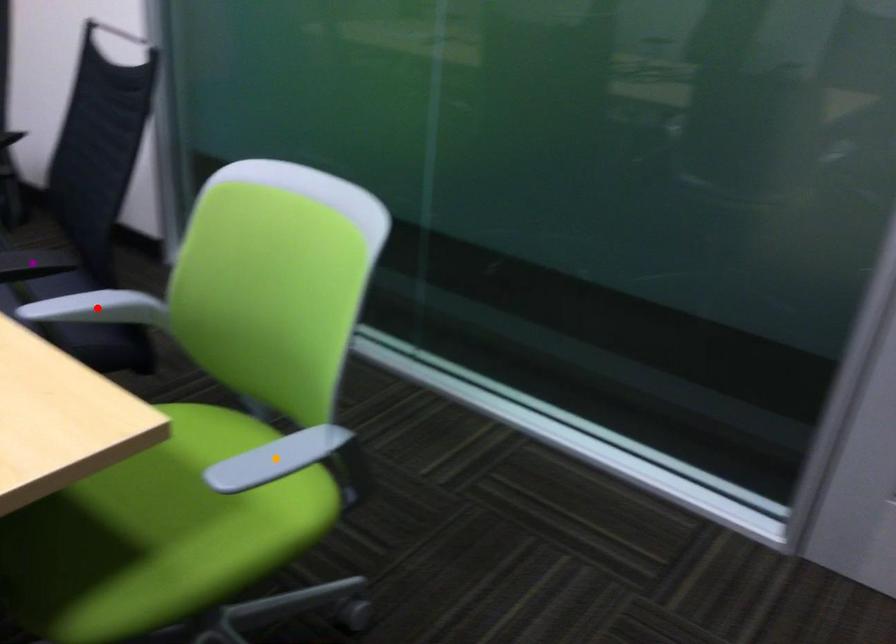
Order these from nearest to farthest:
- orange point
- red point
- purple point

purple point < red point < orange point